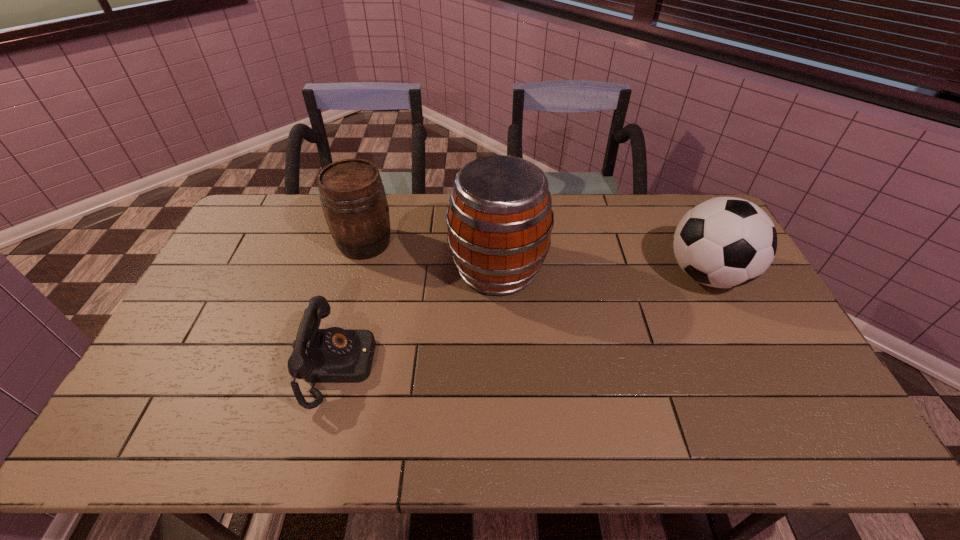
Identify the location of object present at the far edge. (353, 199).

This screenshot has width=960, height=540. In order to click on object positioned at the right edge in this screenshot , I will do `click(724, 242)`.

In the image, there is a desktop. In order to click on vacant space at the far edge in this screenshot , I will do `click(639, 231)`.

In the image, there is a desktop. At what (x,y) coordinates should I click in order to perform the action: click on vacant space at the near edge. Please return your answer as a coordinate pair (x, y). Looking at the image, I should click on (677, 446).

You are a GUI agent. You are given a task and a screenshot of the screen. Output one action in this format:
    pyautogui.click(x=<x>, y=<y>)
    Task: Click on the vacant area at the left edge
    This screenshot has height=540, width=960.
    Given the screenshot: What is the action you would take?
    pyautogui.click(x=159, y=396)

Where is `vacant space at the right edge of the desktop`? vacant space at the right edge of the desktop is located at coordinates (712, 301).

The height and width of the screenshot is (540, 960). Find the location of `vacant space that is in between the telephone and the left cider`. vacant space that is in between the telephone and the left cider is located at coordinates (352, 304).

Identify the location of unoccupied position between the shortest object and the tallest object. (419, 317).

Find the location of a particular element. This screenshot has height=540, width=960. vacant region between the nearest object and the soccer ball is located at coordinates (523, 320).

Locate an element on the screen. This screenshot has height=540, width=960. free space between the third object from left to right and the soccer ball is located at coordinates (602, 272).